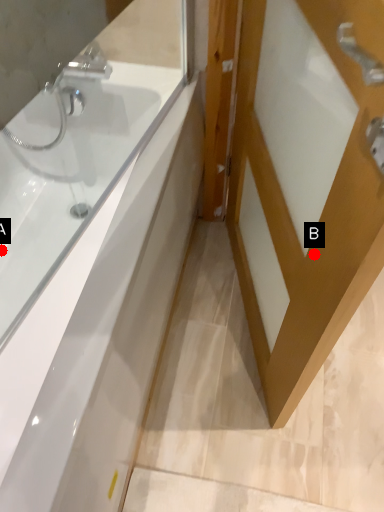
Question: Two points are circled on the image, labeled by A and B beside each circle. Which point is farther to the camera?

Choices:
 (A) A is further
 (B) B is further

Answer: (A)